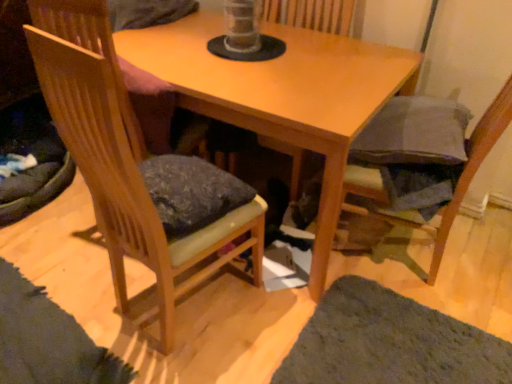
Where is `vacant area that is situated to the right of dark gray fabric cushion at lower right, acting as the 2th chair starting from the left`? Image resolution: width=512 pixels, height=384 pixels. vacant area that is situated to the right of dark gray fabric cushion at lower right, acting as the 2th chair starting from the left is located at coordinates pos(479,253).